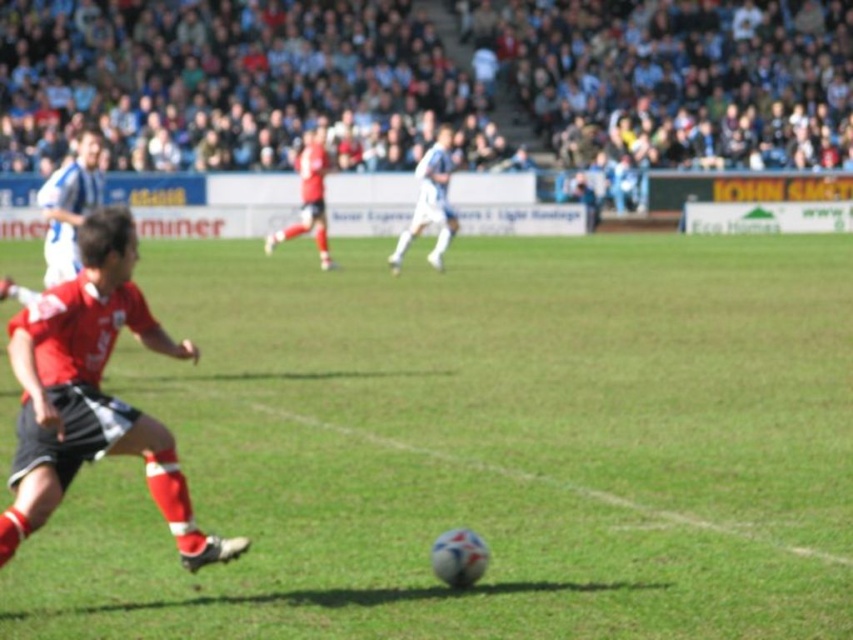
Question: Does red matte jersey at center appear on the right side of matte red jersey at center?

Choices:
 (A) yes
 (B) no

Answer: (A)

Question: Considering the real-world distances, which object is closest to the white jersey at left?

Choices:
 (A) green grass football field at center
 (B) white matte soccer player at center
 (C) red matte jersey at center

Answer: (A)

Question: From the image, what is the correct spatial relationship of green grass football field at center in relation to white jersey at left?

Choices:
 (A) left
 (B) right

Answer: (B)

Question: Which point is closer to the camera?

Choices:
 (A) white jersey at left
 (B) green grass football field at center
 (C) red matte jersey at center
 (D) matte red jersey at center

Answer: (B)

Question: Which object is the closest to the white matte soccer player at center?

Choices:
 (A) matte red jersey at center
 (B) white jersey at left
 (C) red matte jersey at center

Answer: (A)

Question: Can you confirm if white jersey at left is positioned below matte red jersey at center?

Choices:
 (A) no
 (B) yes

Answer: (B)